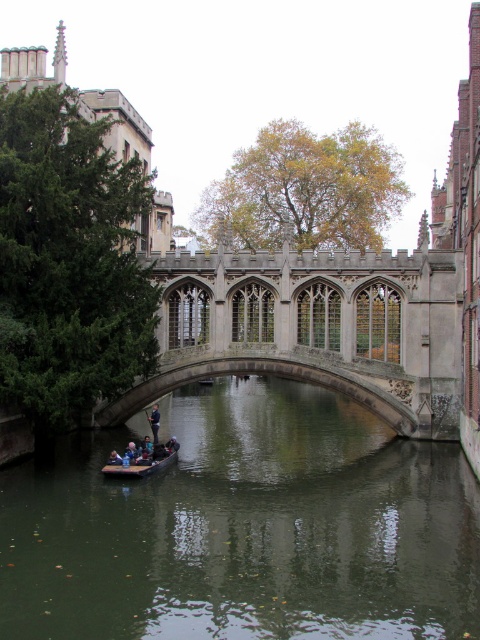
Can you confirm if green murky water at center is bigger than stone gothic bridge at center?

Yes.

Is green murky water at center positioned before stone gothic bridge at center?

Yes.

Is point (219, 440) positioned in front of point (262, 307)?

No, (219, 440) is behind (262, 307).

I want to click on green murky water at center, so click(244, 529).

From the picture: Between wooden canoe at center and dark blue fabric jacket at center, which one has less height?

Standing shorter between the two is wooden canoe at center.

Which is behind, point (146, 464) or point (158, 412)?

The point (158, 412) is behind.

Does point (129, 468) come closer to viewer compared to point (156, 429)?

Yes.

This screenshot has width=480, height=640. What are the coordinates of `wooden canoe at center` in the screenshot? It's located at (141, 465).

Is point (264, 272) farther from camera compared to point (120, 472)?

Yes, it is.

Which is in front, point (168, 348) or point (132, 465)?

Point (132, 465)

This screenshot has height=640, width=480. What are the coordinates of `stone gothic bridge at center` in the screenshot? It's located at (315, 326).